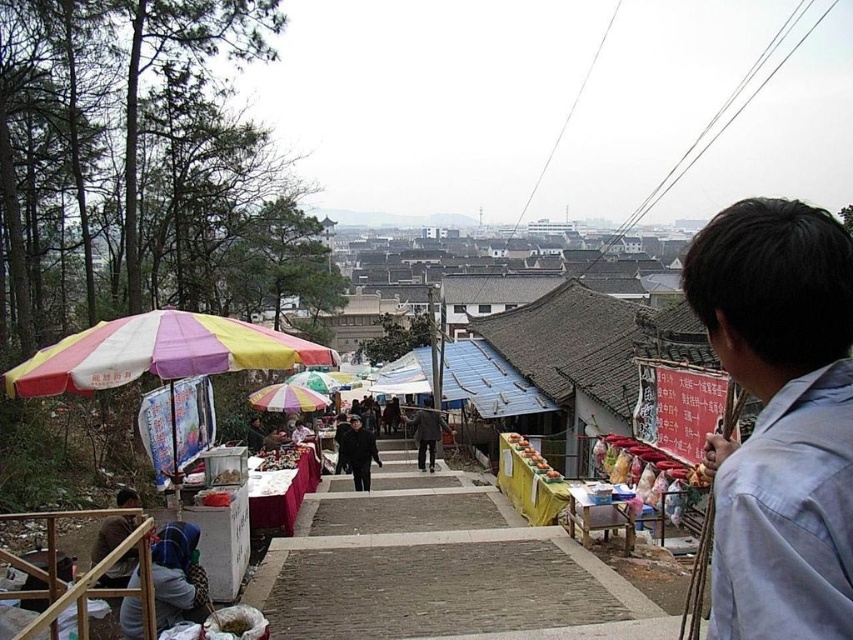
Can you confirm if rainbow fabric umbrella at left is bigger than rainbow striped fabric umbrella at center?

Correct, rainbow fabric umbrella at left is larger in size than rainbow striped fabric umbrella at center.

Where is `rainbow fabric umbrella at left`? This screenshot has width=853, height=640. rainbow fabric umbrella at left is located at coordinates (158, 353).

Does dark gray fabric coat at center have a lesser width compared to dark gray coat at center?

Yes.

Between point (358, 444) and point (430, 396), which one is positioned in front?

Point (358, 444)

Identify the location of dark gray fabric coat at center. (358, 452).

Is point (515, 548) positioned before point (250, 400)?

Yes, it is in front of point (250, 400).

What do you see at coordinates (434, 566) in the screenshot?
I see `concrete steps at center` at bounding box center [434, 566].

Does point (318, 616) come farther from viewer compared to point (305, 388)?

No, it is in front of (305, 388).

Locate an element on the screen. The image size is (853, 640). concrete steps at center is located at coordinates (434, 566).